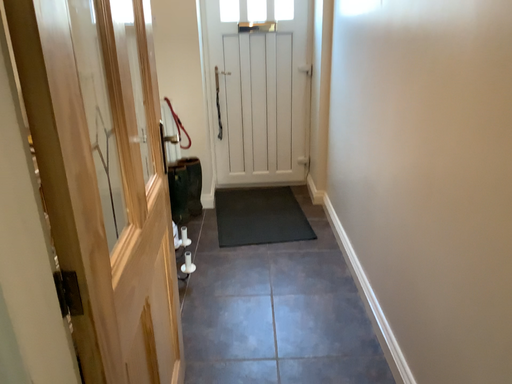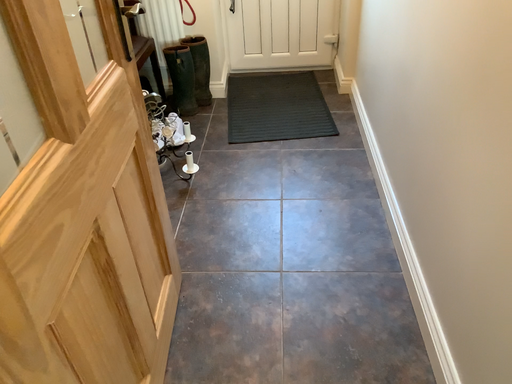
Question: How did the camera likely rotate when shooting the video?

Choices:
 (A) rotated downward
 (B) rotated upward

Answer: (A)